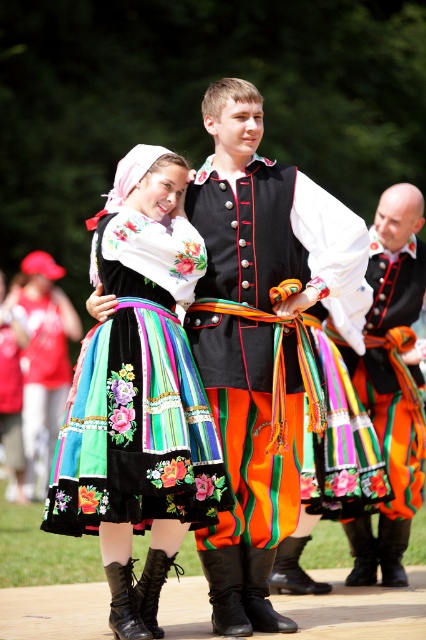
Question: Does embroidered fabric dress at center appear on the right side of velvet black vest at center?

Choices:
 (A) no
 (B) yes

Answer: (A)

Question: Which point is farther to the camera?

Choices:
 (A) (184, 244)
 (B) (406, 531)
 (C) (293, 369)

Answer: (B)

Question: Does embroidered fabric dress at center appear on the left side of matte black vest at center?

Choices:
 (A) yes
 (B) no

Answer: (A)

Question: Among these points, which one is nearest to the camera?

Choices:
 (A) (416, 506)
 (B) (68, 436)
 (C) (250, 195)

Answer: (B)

Question: Among these objects, which one is farthest from the camera?

Choices:
 (A) velvet black vest at center
 (B) matte black vest at center

Answer: (B)

Question: Can you confirm if velvet black vest at center is positioned below matte black vest at center?

Choices:
 (A) no
 (B) yes

Answer: (A)